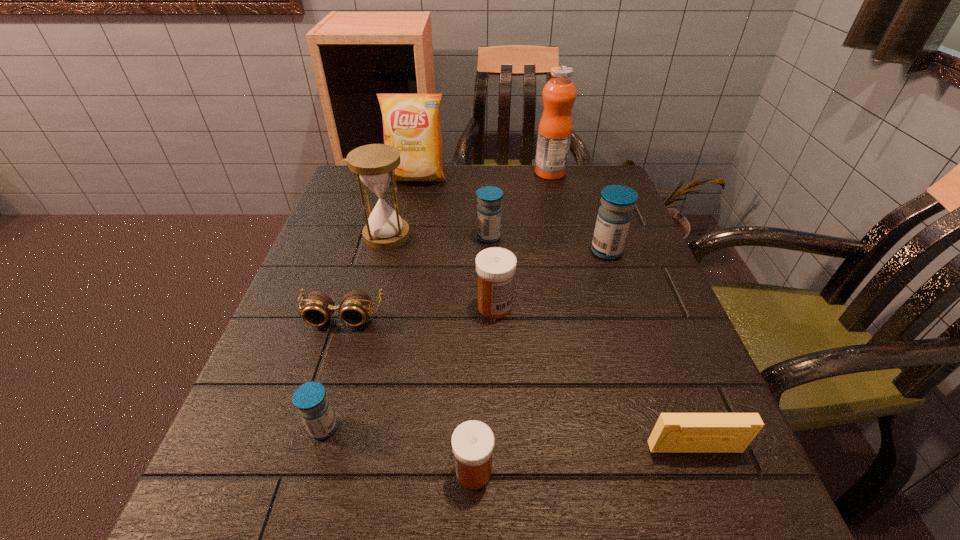
Identify the location of free space located 0.260m on the right of the second blue medicine from right to left. The height and width of the screenshot is (540, 960). (612, 237).

Locate an element on the screen. This screenshot has height=540, width=960. free space located 0.370m on the front of the third farthest medicine is located at coordinates (503, 532).

Locate an element on the screen. free point located on the back of the nearest medicine is located at coordinates (476, 282).

I want to click on vacant space located on the right of the second nearest medicine, so click(572, 428).

Find the location of a particular element. free point located at the front of the beige videotape with spools is located at coordinates (714, 498).

You are a GUI agent. You are given a task and a screenshot of the screen. Output one action in this format:
    pyautogui.click(x=<x>, y=<y>)
    Task: Click on the vacant space located through the lenses of the goggles
    The height and width of the screenshot is (540, 960).
    Given the screenshot: What is the action you would take?
    pyautogui.click(x=315, y=401)

You are a GUI agent. You are given a task and a screenshot of the screen. Output one action in this format:
    pyautogui.click(x=<x>, y=<y>)
    Task: Click on the fruit juice that is at the far edge
    This screenshot has width=960, height=540.
    Given the screenshot: What is the action you would take?
    pyautogui.click(x=555, y=127)

In order to click on crisp (potato chip) present at the far edge in this screenshot , I will do pyautogui.click(x=411, y=122).

Locate an element on the screen. This screenshot has height=540, width=960. object located at the near edge is located at coordinates (472, 441).

At what (x,y) coordinates should I click in order to perform the action: click on crisp (potato chip) present at the left edge. Please return your answer as a coordinate pair (x, y). The height and width of the screenshot is (540, 960). Looking at the image, I should click on (411, 122).